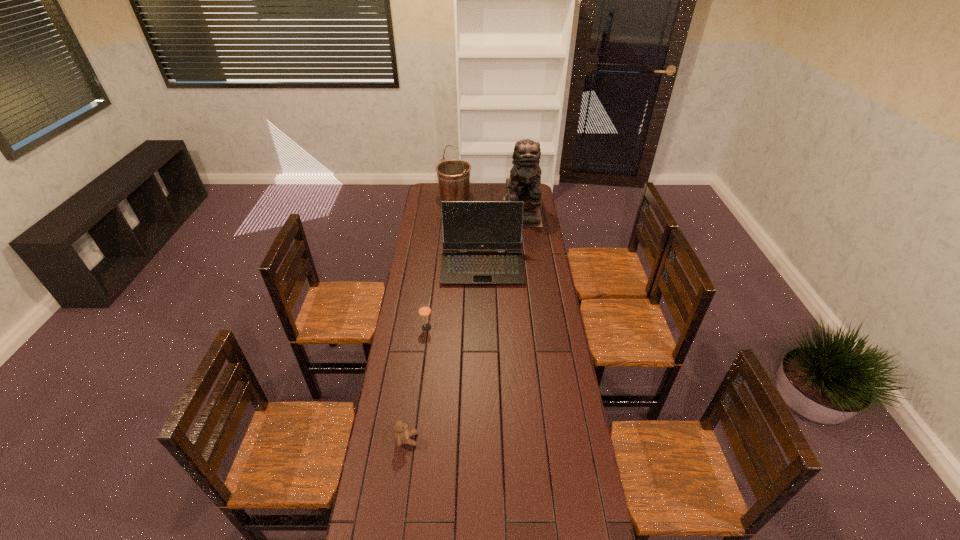
Identify the location of vacant space located 0.110m on the screen of the third shortest object. (483, 302).

Identify the location of blank space located on the front of the fourth farthest object. (420, 386).

Identify the location of free space located 0.100m on the front-facing side of the nearest object. This screenshot has width=960, height=540. (445, 440).

Where is `sculpture present at the far edge`? The width and height of the screenshot is (960, 540). sculpture present at the far edge is located at coordinates (524, 182).

Image resolution: width=960 pixels, height=540 pixels. I want to click on bucket that is positioned at the far edge, so point(453,176).

Where is `bucket located at the left edge`? The width and height of the screenshot is (960, 540). bucket located at the left edge is located at coordinates (453, 176).

At what (x,y) coordinates should I click in order to perform the action: click on straw at the left edge. Please return your answer as a coordinate pair (x, y). The height and width of the screenshot is (540, 960). Looking at the image, I should click on (424, 310).

Where is `teddy bear located in the left edge section of the desktop`? The image size is (960, 540). teddy bear located in the left edge section of the desktop is located at coordinates (402, 434).

The image size is (960, 540). I want to click on sculpture present at the right edge, so click(524, 182).

Identify the location of laptop computer located in the right edge section of the desktop. click(466, 225).